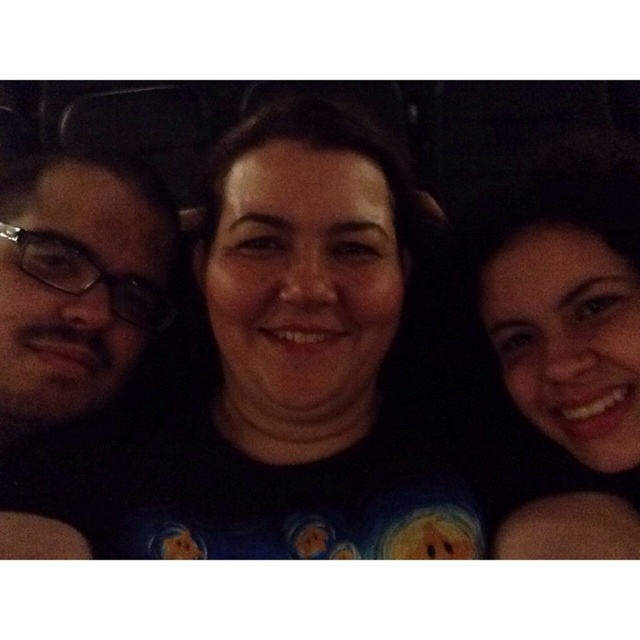
Which of these two, dark matte glasses at left or transparent plastic glasses at left, stands taller?

dark matte glasses at left

Is dark matte glasses at left to the left of transparent plastic glasses at left from the viewer's perspective?

Indeed, dark matte glasses at left is positioned on the left side of transparent plastic glasses at left.

Between point (70, 372) and point (156, 310), which one is positioned in front?

Point (70, 372)

Find the location of a particular element. dark matte glasses at left is located at coordinates (70, 323).

Who is positioned more to the left, black matte shirt at center or dark matte glasses at left?

dark matte glasses at left is more to the left.

Can you confirm if black matte shirt at center is wider than dark matte glasses at left?

Yes.

Is point (392, 552) farther from viewer compared to point (170, 246)?

No, (392, 552) is closer to viewer.

Find the location of a particular element. This screenshot has height=640, width=640. black matte shirt at center is located at coordinates (298, 364).

Is smooth skin at right in front of dark matte glasses at left?

Yes, smooth skin at right is closer to the viewer.

Does smooth skin at right appear on the left side of dark matte glasses at left?

Incorrect, smooth skin at right is not on the left side of dark matte glasses at left.

The height and width of the screenshot is (640, 640). What are the coordinates of `smooth skin at right` in the screenshot? It's located at (570, 339).

Where is `smooth skin at right`? The width and height of the screenshot is (640, 640). smooth skin at right is located at coordinates (570, 339).